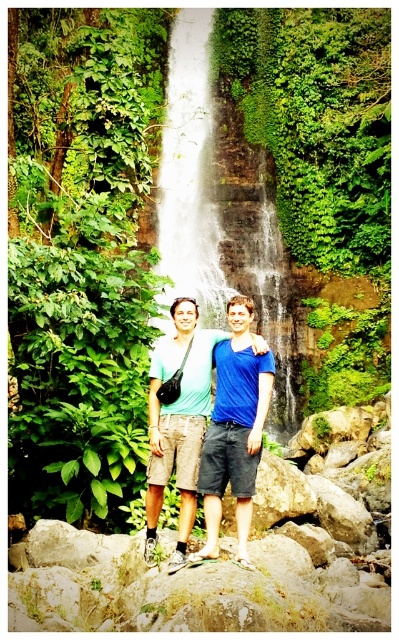
Question: Does white textured waterfall at center appear on the right side of blue matte shirt at center?

Choices:
 (A) yes
 (B) no

Answer: (B)

Question: Does white textured waterfall at center come in front of blue matte shirt at center?

Choices:
 (A) yes
 (B) no

Answer: (B)

Question: Among these objects, which one is nearest to the camera?

Choices:
 (A) white textured waterfall at center
 (B) blue matte shirt at center

Answer: (B)

Question: Which point is farther to the camera?

Choices:
 (A) blue matte shirt at center
 (B) white textured waterfall at center

Answer: (B)

Question: Can you confirm if white textured waterfall at center is positioned below blue matte shirt at center?

Choices:
 (A) yes
 (B) no

Answer: (B)